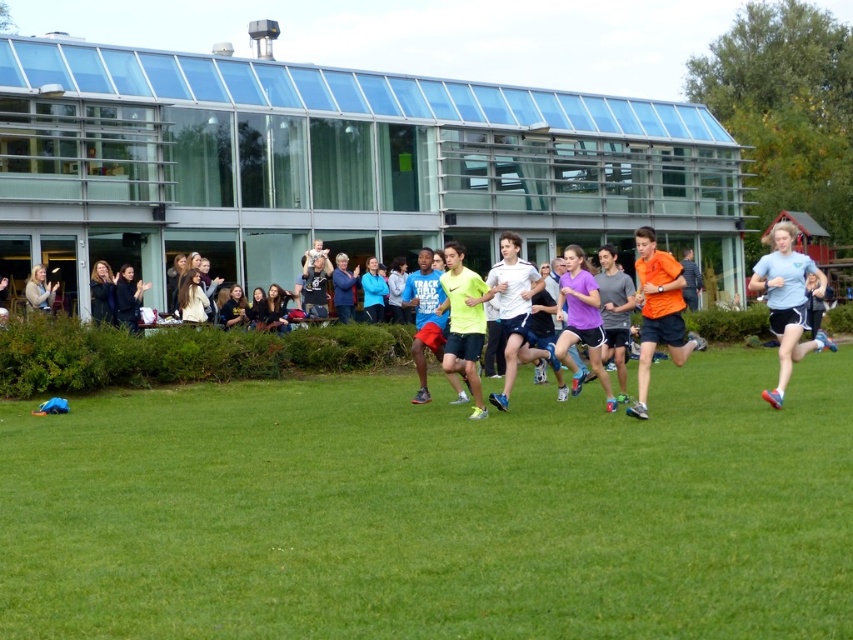
Does light blue fabric shorts at right appear under neon yellow running shirt at center?

No, light blue fabric shorts at right is not below neon yellow running shirt at center.

Who is higher up, light blue fabric shorts at right or neon yellow running shirt at center?

light blue fabric shorts at right is higher up.

Is point (779, 227) in front of point (451, 250)?

That is True.

Identify the location of light blue fabric shorts at right. (787, 301).

Is dark blue fabric jacket at left closer to the viewer compared to matte black shirt at center?

Yes, it is in front of matte black shirt at center.

Based on the photo, who is positioned more to the left, dark blue fabric jacket at left or matte black shirt at center?

dark blue fabric jacket at left is more to the left.

Image resolution: width=853 pixels, height=640 pixels. Describe the element at coordinates (128, 298) in the screenshot. I see `dark blue fabric jacket at left` at that location.

Where is `dark blue fabric jacket at left`? This screenshot has width=853, height=640. dark blue fabric jacket at left is located at coordinates (128, 298).

Between green grass at lower center and white matte shirt at center, which one is positioned higher?

white matte shirt at center

Is the position of green grass at lower center more distant than that of white matte shirt at center?

That is False.

Describe the element at coordinates (434, 509) in the screenshot. The width and height of the screenshot is (853, 640). I see `green grass at lower center` at that location.

Locate an element on the screen. Image resolution: width=853 pixels, height=640 pixels. green grass at lower center is located at coordinates (434, 509).